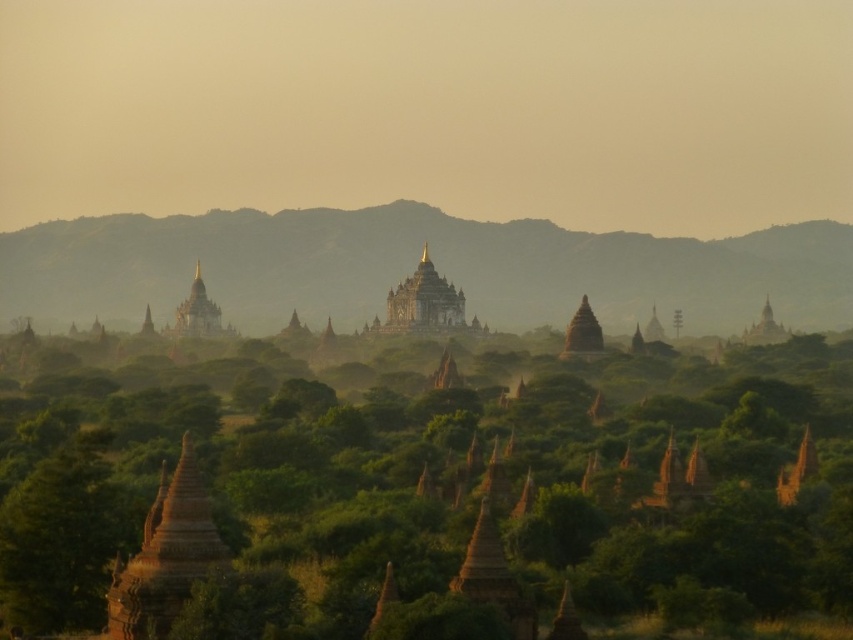
Question: Which of the following is the farthest from the observer?

Choices:
 (A) (427, 301)
 (B) (74, 628)
 (C) (196, 291)

Answer: (C)

Question: Is brown textured stupa at center wider than gold/golden stupa at center?

Choices:
 (A) yes
 (B) no

Answer: (A)

Question: Estimate the real-world distances between objects in this image. Which object is farther from the brown textured stupa at center?

Choices:
 (A) golden stone temple at center
 (B) gold/golden stupa at center

Answer: (B)

Question: Is brown textured stupa at center smaller than golden stone temple at center?

Choices:
 (A) yes
 (B) no

Answer: (B)

Question: Does brown textured stupa at center have a lesser width compared to golden stone temple at center?

Choices:
 (A) no
 (B) yes

Answer: (A)

Question: Which object appears farthest from the camera in this image?

Choices:
 (A) brown textured stupa at center
 (B) golden stone temple at center

Answer: (B)